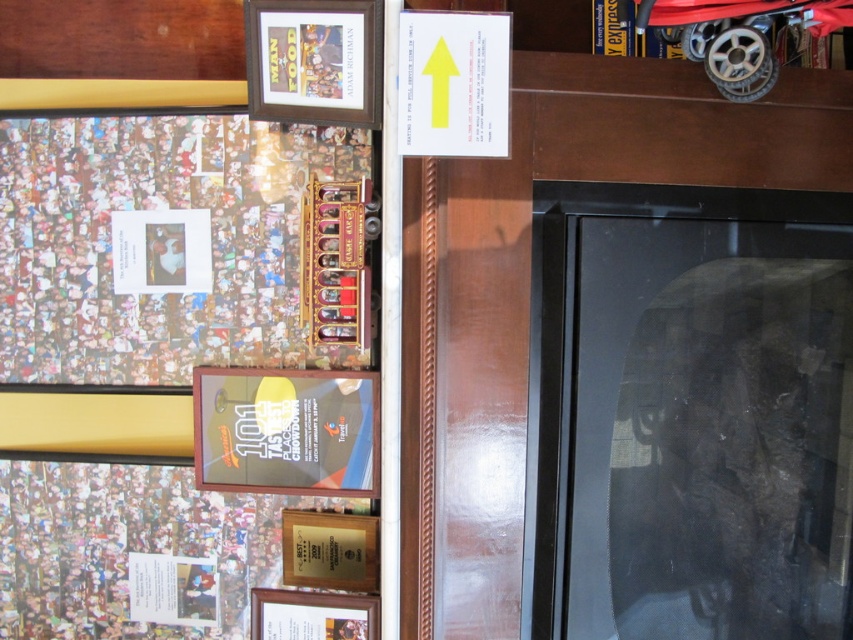
Who is shorter, black glass fireplace at right or wooden picture frame at lower center?

wooden picture frame at lower center is shorter.

Does black glass fireplace at right lie in front of wooden picture frame at lower center?

Yes.

Who is more distant from viewer, [553,628] or [370,596]?

Point [370,596]

Locate an element on the screen. This screenshot has height=640, width=853. black glass fireplace at right is located at coordinates (689, 413).

Does matte plastic picture frame at center have a smaller size compared to wooden picture frame at lower center?

No, matte plastic picture frame at center is not smaller than wooden picture frame at lower center.

Can you confirm if matte plastic picture frame at center is taller than wooden picture frame at lower center?

Indeed, matte plastic picture frame at center has a greater height compared to wooden picture frame at lower center.

Does point (291, 461) come farther from viewer compared to point (285, 627)?

No, it is not.

At what (x,y) coordinates should I click in order to perform the action: click on matte plastic picture frame at center. Please return your answer as a coordinate pair (x, y). Image resolution: width=853 pixels, height=640 pixels. Looking at the image, I should click on (285, 429).

Between black glass fireplace at right and wooden plaque at lower center, which one has less height?

With less height is wooden plaque at lower center.

Is black glass fireplace at right further to camera compared to wooden plaque at lower center?

No, black glass fireplace at right is in front of wooden plaque at lower center.

I want to click on black glass fireplace at right, so click(689, 413).